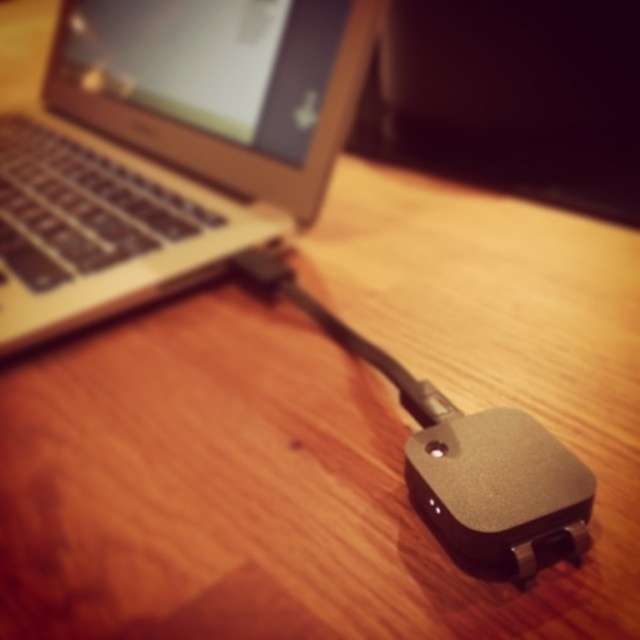
Does satin gold laptop at upper left have a greater width compared to satin black mouse at lower right?

Indeed, satin gold laptop at upper left has a greater width compared to satin black mouse at lower right.

The image size is (640, 640). What are the coordinates of `satin gold laptop at upper left` in the screenshot? It's located at (168, 148).